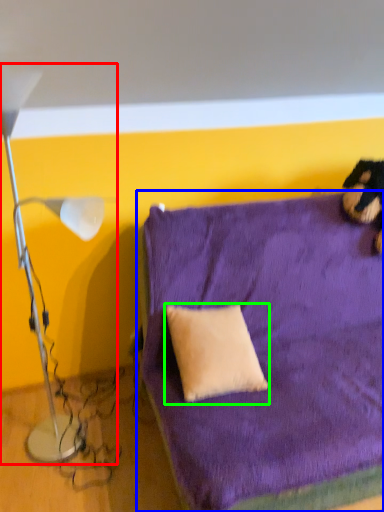
Question: Estimate the real-world distances between objects in this image. Which object is farther from lamp (highlighted by a red box), furniture (highlighted by a blue box) or pillow (highlighted by a green box)?

Choices:
 (A) furniture
 (B) pillow

Answer: (A)